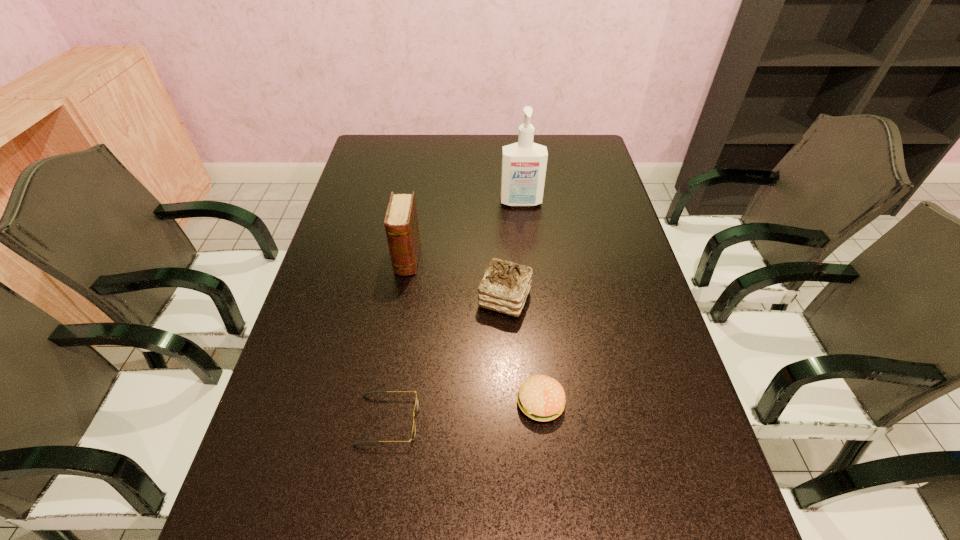
Locate an element on the screen. The image size is (960, 540). cleansing agent is located at coordinates (524, 163).

This screenshot has height=540, width=960. Find the location of `the tallest object`. the tallest object is located at coordinates (524, 163).

At what (x,y) coordinates should I click in order to perform the action: click on diary. Please return your answer as a coordinate pair (x, y). Looking at the image, I should click on (401, 223).

At what (x,y) coordinates should I click in order to perform the action: click on the fourth nearest object. Please return your answer as a coordinate pair (x, y). This screenshot has height=540, width=960. Looking at the image, I should click on (401, 223).

At what (x,y) coordinates should I click in order to perform the action: click on the third nearest object. Please return your answer as a coordinate pair (x, y). The height and width of the screenshot is (540, 960). Looking at the image, I should click on (505, 286).

Locate an element on the screen. chocolate cake is located at coordinates (505, 286).

In order to click on the fourth tallest object in this screenshot , I will do `click(542, 398)`.

You are a GUI agent. You are given a task and a screenshot of the screen. Output one action in this format:
    pyautogui.click(x=<x>, y=<y>)
    Task: Click on the sunglasses
    This screenshot has height=540, width=960.
    Given the screenshot: What is the action you would take?
    pyautogui.click(x=367, y=393)

Image resolution: width=960 pixels, height=540 pixels. I want to click on vacant space located 0.160m on the front label of the tallest object, so click(525, 244).

What are the coordinates of `vacant area situated on the spine side of the fourth nearest object` in the screenshot? It's located at (387, 383).